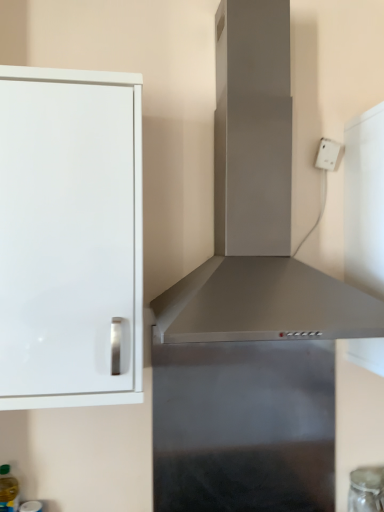
Question: Considering the relative sizes of translucent plastic bottle at lower left and satin silver vent at center in the image provided, is translucent plastic bottle at lower left shorter than satin silver vent at center?

Choices:
 (A) yes
 (B) no

Answer: (A)

Question: Does translucent plastic bottle at lower left come in front of satin silver vent at center?

Choices:
 (A) yes
 (B) no

Answer: (B)

Question: From a real-world perspective, is translucent plastic bottle at lower left under satin silver vent at center?

Choices:
 (A) yes
 (B) no

Answer: (A)

Question: Are translucent plastic bottle at lower left and satin silver vent at center located far from each other?

Choices:
 (A) no
 (B) yes

Answer: (B)

Question: Is translucent plastic bottle at lower left at the right side of satin silver vent at center?

Choices:
 (A) yes
 (B) no

Answer: (B)

Question: Does translucent plastic bottle at lower left have a greater height compared to satin silver vent at center?

Choices:
 (A) no
 (B) yes

Answer: (A)

Question: Is transparent glass jar at lower right in front of translucent plastic bottle at lower left?

Choices:
 (A) yes
 (B) no

Answer: (B)

Question: Considering the relative sizes of transparent glass jar at lower right and translucent plastic bottle at lower left in the image provided, is transparent glass jar at lower right taller than translucent plastic bottle at lower left?

Choices:
 (A) yes
 (B) no

Answer: (B)

Question: From a real-world perspective, is transparent glass jar at lower right beneath translucent plastic bottle at lower left?

Choices:
 (A) no
 (B) yes

Answer: (B)

Question: Considering the relative sizes of transparent glass jar at lower right and translucent plastic bottle at lower left in the image provided, is transparent glass jar at lower right smaller than translucent plastic bottle at lower left?

Choices:
 (A) no
 (B) yes

Answer: (A)

Question: Is transparent glass jar at lower right bigger than translucent plastic bottle at lower left?

Choices:
 (A) yes
 (B) no

Answer: (A)

Question: Is transparent glass jar at lower right outside of translucent plastic bottle at lower left?

Choices:
 (A) yes
 (B) no

Answer: (A)

Question: Can we say translucent plastic bottle at lower left lies outside transparent glass jar at lower right?

Choices:
 (A) no
 (B) yes

Answer: (B)